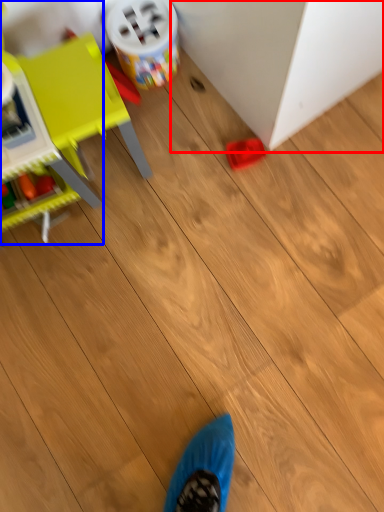
Question: Which point is further to the camera, furniture (highlighted by a red box) or toy (highlighted by a blue box)?

Choices:
 (A) furniture
 (B) toy

Answer: (A)